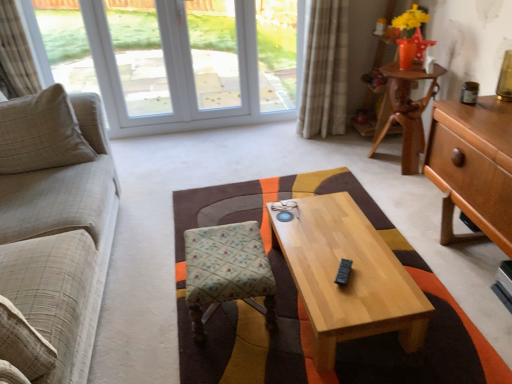
Where is `vacant area that lies to the right of matte brown jar at upper right`? vacant area that lies to the right of matte brown jar at upper right is located at coordinates (493, 100).